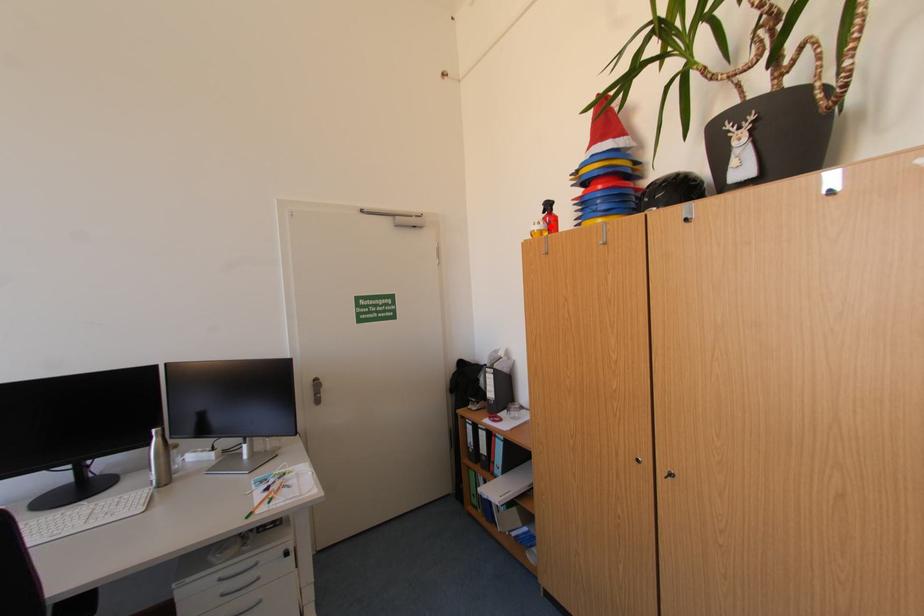
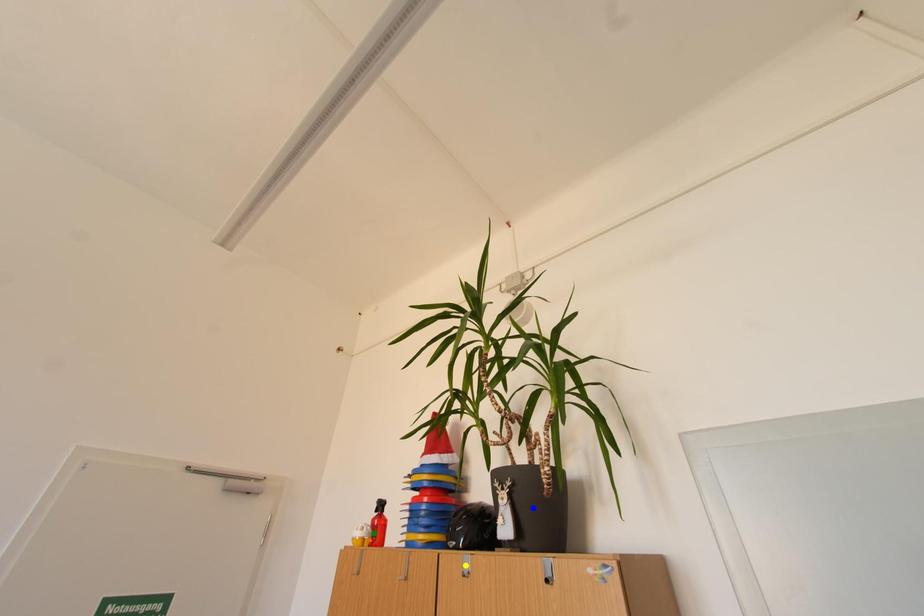
Question: I am providing you with two images of the same scene from different viewpoints. A red point is marked on the first image. You are given multiple points on the second image. Which point in image 2 represents the same 3d spot as the red point in image 1?

Choices:
 (A) green point
 (B) yellow point
 (C) blue point

Answer: (A)